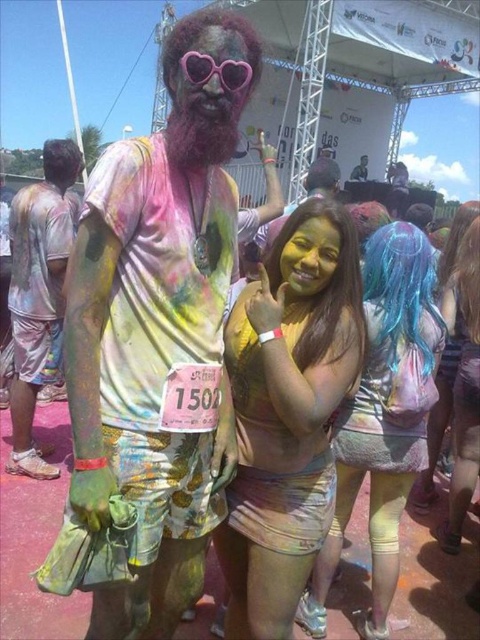
Question: Which of the following is the closest to the observer?

Choices:
 (A) (380, 291)
 (B) (327, 314)

Answer: (B)

Question: Estimate the real-world distances between objects in this image. Which object is closer to the pastel dyed hair at center?

Choices:
 (A) pink heart-shaped goggles at upper center
 (B) pink matte heart-shaped sunglasses at center

Answer: (B)

Question: Is pink matte heart-shaped sunglasses at center above pink heart-shaped goggles at upper center?

Choices:
 (A) no
 (B) yes

Answer: (B)

Question: Is multicolored painted shirt at center in front of matte yellow face at center?

Choices:
 (A) no
 (B) yes

Answer: (B)

Question: Estimate the real-world distances between objects in this image. Which object is closer to the matte yellow face at center?

Choices:
 (A) pastel dyed hair at center
 (B) multicolored painted shirt at center

Answer: (B)

Question: Is the position of pastel dyed hair at center more distant than that of pastel tie-dye dress at center?

Choices:
 (A) no
 (B) yes

Answer: (A)